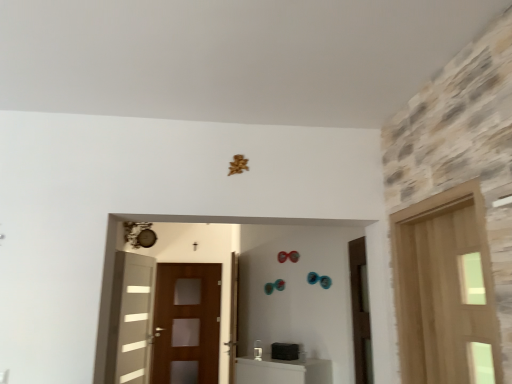
Describe the element at coordinates (360, 312) in the screenshot. I see `brown matte door at right, positioned as the 2th door in front-to-back order` at that location.

At what (x,y) coordinates should I click in order to perform the action: click on wooden door at center, which is the 3th door from right to left. Please return your answer as a coordinate pair (x, y). Looking at the image, I should click on point(233,317).

You are a GUI agent. You are given a task and a screenshot of the screen. Output one action in this format:
    pyautogui.click(x=<x>, y=<y>)
    Task: Click on the light wood door at right, marked as the fourth door in a back-to-front arrangement
    The image size is (512, 384).
    Given the screenshot: What is the action you would take?
    pyautogui.click(x=445, y=290)

Measure the distance between light wood door at right, which is counted as the first door, starting from the right, and camera.

A distance of 5.39 feet exists between light wood door at right, which is counted as the first door, starting from the right, and camera.

Find the location of a particular element. This screenshot has width=512, height=384. brown wooden screen door at center is located at coordinates (187, 320).

Considering the points (149, 329) and (349, 258), which point is behind, point (149, 329) or point (349, 258)?

The point (149, 329) is behind.

In the scene shown: Is white glossy door at left, arranged as the 4th door when viewed from the right, situated inside brown matte door at right, marked as the 3th door in a back-to-front arrangement, or outside?

white glossy door at left, arranged as the 4th door when viewed from the right, is located beyond the bounds of brown matte door at right, marked as the 3th door in a back-to-front arrangement.

How distant is white glossy door at left, which appears as the first door when viewed from the back, from brown matte door at right, which is counted as the second door, starting from the right?

white glossy door at left, which appears as the first door when viewed from the back, is 7.79 feet away from brown matte door at right, which is counted as the second door, starting from the right.

Is white glossy door at left, which appears as the first door when viewed from the back, turned away from brown matte door at right, marked as the 3th door in a back-to-front arrangement?

No, brown matte door at right, marked as the 3th door in a back-to-front arrangement, is not at the back of white glossy door at left, which appears as the first door when viewed from the back.

Does point (138, 323) come farther from viewer compared to point (433, 295)?

Yes.

Is light wood door at right, marked as the fourth door in a back-to-front arrangement, at the back of white glossy door at left, placed as the first door when sorted from left to right?

No, white glossy door at left, placed as the first door when sorted from left to right, is not facing away from light wood door at right, marked as the fourth door in a back-to-front arrangement.

Considering the relative positions of white glossy door at left, arranged as the 4th door when viewed from the right, and light wood door at right, marked as the fourth door in a back-to-front arrangement, in the image provided, is white glossy door at left, arranged as the 4th door when viewed from the right, to the left of light wood door at right, marked as the fourth door in a back-to-front arrangement, from the viewer's perspective?

Indeed, white glossy door at left, arranged as the 4th door when viewed from the right, is positioned on the left side of light wood door at right, marked as the fourth door in a back-to-front arrangement.

Is brown matte door at right, marked as the 3th door in a back-to-front arrangement, further to the viewer compared to white glossy door at left, which is the 4th door from front to back?

No, the depth of brown matte door at right, marked as the 3th door in a back-to-front arrangement, is less than that of white glossy door at left, which is the 4th door from front to back.

In the scene shown: Is brown matte door at right, marked as the 3th door in a back-to-front arrangement, to the left of white glossy door at left, placed as the first door when sorted from left to right, from the viewer's perspective?

In fact, brown matte door at right, marked as the 3th door in a back-to-front arrangement, is to the right of white glossy door at left, placed as the first door when sorted from left to right.

Considering the sizes of brown matte door at right, which is counted as the second door, starting from the right, and white glossy door at left, arranged as the 4th door when viewed from the right, in the image, is brown matte door at right, which is counted as the second door, starting from the right, taller or shorter than white glossy door at left, arranged as the 4th door when viewed from the right,?

Considering their sizes, brown matte door at right, which is counted as the second door, starting from the right, has less height than white glossy door at left, arranged as the 4th door when viewed from the right.

From a real-world perspective, relative to white glossy door at left, which appears as the first door when viewed from the back, is brown matte door at right, positioned as the 2th door in front-to-back order, vertically above or below?

From a real-world perspective, brown matte door at right, positioned as the 2th door in front-to-back order, is physically above white glossy door at left, which appears as the first door when viewed from the back.

Who is taller, brown matte door at right, positioned as the 2th door in front-to-back order, or brown wooden screen door at center?

brown wooden screen door at center is taller.

Based on the photo, considering the relative sizes of brown matte door at right, positioned as the 2th door in front-to-back order, and brown wooden screen door at center in the image provided, is brown matte door at right, positioned as the 2th door in front-to-back order, thinner than brown wooden screen door at center?

No.

Is brown matte door at right, positioned as the 2th door in front-to-back order, smaller than brown wooden screen door at center?

Correct, brown matte door at right, positioned as the 2th door in front-to-back order, occupies less space than brown wooden screen door at center.

Could you tell me if light wood door at right, marked as the fourth door in a back-to-front arrangement, is facing brown matte door at right, which is counted as the second door, starting from the right?

No, light wood door at right, marked as the fourth door in a back-to-front arrangement, is not facing towards brown matte door at right, which is counted as the second door, starting from the right.

Which object is thinner, light wood door at right, marked as the fourth door in a back-to-front arrangement, or brown matte door at right, which is counted as the second door, starting from the right?

With smaller width is brown matte door at right, which is counted as the second door, starting from the right.

Is light wood door at right, which is counted as the first door, starting from the right, not inside brown matte door at right, positioned as the 2th door in front-to-back order?

Absolutely, light wood door at right, which is counted as the first door, starting from the right, is external to brown matte door at right, positioned as the 2th door in front-to-back order.

From the image's perspective, is light wood door at right, marked as the fourth door in a back-to-front arrangement, over brown matte door at right, the 3th door positioned from the left?

Yes, from the image's perspective, light wood door at right, marked as the fourth door in a back-to-front arrangement, is over brown matte door at right, the 3th door positioned from the left.

How different are the orientations of brown matte door at right, marked as the 3th door in a back-to-front arrangement, and light wood door at right, which is counted as the first door, starting from the front, in degrees?

0.00168 degrees.

From the picture: Does brown matte door at right, marked as the 3th door in a back-to-front arrangement, turn towards light wood door at right, marked as the fourth door in a back-to-front arrangement?

No.

Can you confirm if brown matte door at right, which is counted as the second door, starting from the right, is wider than light wood door at right, marked as the fourth door in a back-to-front arrangement?

No, brown matte door at right, which is counted as the second door, starting from the right, is not wider than light wood door at right, marked as the fourth door in a back-to-front arrangement.

From a real-world perspective, which door is the 1st one underneath the light wood door at right, which is counted as the first door, starting from the front? Please provide its 2D coordinates.

[(360, 312)]

Is point (486, 323) closer to viewer compared to point (232, 292)?

Yes, it is in front of point (232, 292).

Is light wood door at right, marked as the fourth door in a back-to-front arrangement, wider than wooden door at center, which ranks as the 2th door in left-to-right order?

Indeed, light wood door at right, marked as the fourth door in a back-to-front arrangement, has a greater width compared to wooden door at center, which ranks as the 2th door in left-to-right order.

Would you say light wood door at right, marked as the fourth door in a back-to-front arrangement, is inside or outside wooden door at center, which ranks as the 2th door in left-to-right order?

light wood door at right, marked as the fourth door in a back-to-front arrangement, lies outside wooden door at center, which ranks as the 2th door in left-to-right order.

From the image's perspective, is light wood door at right, which is counted as the first door, starting from the front, above or below wooden door at center, which ranks as the 2th door in left-to-right order?

From the image's perspective, light wood door at right, which is counted as the first door, starting from the front, appears above wooden door at center, which ranks as the 2th door in left-to-right order.

You are a GUI agent. You are given a task and a screenshot of the screen. Output one action in this format:
    pyautogui.click(x=<x>, y=<y>)
    Task: Click on the 2nd door in front of the white glossy door at left, which is the 4th door from front to back
    The height and width of the screenshot is (384, 512).
    Given the screenshot: What is the action you would take?
    pyautogui.click(x=360, y=312)

Image resolution: width=512 pixels, height=384 pixels. I want to click on the 3rd door to the right when counting from the white glossy door at left, which is the 4th door from front to back, so click(445, 290).

From the picture: From the image, which object appears to be farther from white glossy door at left, which appears as the first door when viewed from the back, brown matte door at right, the 3th door positioned from the left, or wooden door at center, the second door when ordered from back to front?

brown matte door at right, the 3th door positioned from the left, is further to white glossy door at left, which appears as the first door when viewed from the back.

Which object lies further to the anchor point white glossy door at left, which is the 4th door from front to back, wooden door at center, which is the 3th door from right to left, or brown matte door at right, marked as the 3th door in a back-to-front arrangement?

brown matte door at right, marked as the 3th door in a back-to-front arrangement, is further to white glossy door at left, which is the 4th door from front to back.

Looking at the image, which one is located closer to wooden door at center, which is the 3th door from right to left, brown matte door at right, which is counted as the second door, starting from the right, or brown wooden screen door at center?

brown wooden screen door at center is closer to wooden door at center, which is the 3th door from right to left.

Which object lies further to the anchor point white glossy door at left, arranged as the 4th door when viewed from the right, wooden door at center, the 3th door positioned from the front, or brown wooden screen door at center?

Based on the image, wooden door at center, the 3th door positioned from the front, appears to be further to white glossy door at left, arranged as the 4th door when viewed from the right.

Looking at the image, which one is located closer to brown matte door at right, positioned as the 2th door in front-to-back order, light wood door at right, marked as the fourth door in a back-to-front arrangement, or brown wooden screen door at center?

The object closer to brown matte door at right, positioned as the 2th door in front-to-back order, is light wood door at right, marked as the fourth door in a back-to-front arrangement.

Estimate the real-world distances between objects in this image. Which object is further from brown matte door at right, the 3th door positioned from the left, white glossy door at left, arranged as the 4th door when viewed from the right, or light wood door at right, which is counted as the fourth door, starting from the left?

white glossy door at left, arranged as the 4th door when viewed from the right.

Based on their spatial positions, is brown matte door at right, marked as the 3th door in a back-to-front arrangement, or white glossy door at left, placed as the first door when sorted from left to right, further from brown wooden screen door at center?

brown matte door at right, marked as the 3th door in a back-to-front arrangement, is positioned further to the anchor brown wooden screen door at center.

Consider the image. Which object lies further to the anchor point wooden door at center, the 3th door positioned from the front, light wood door at right, marked as the fourth door in a back-to-front arrangement, or brown wooden screen door at center?

The object further to wooden door at center, the 3th door positioned from the front, is light wood door at right, marked as the fourth door in a back-to-front arrangement.

You are a GUI agent. You are given a task and a screenshot of the screen. Output one action in this format:
    pyautogui.click(x=<x>, y=<y>)
    Task: Click on the door between wooden door at center, the 3th door positioned from the front, and brown wooden screen door at center in the front-back direction
    The width and height of the screenshot is (512, 384).
    Given the screenshot: What is the action you would take?
    pyautogui.click(x=131, y=319)

The width and height of the screenshot is (512, 384). Identify the location of door positioned between light wood door at right, which is counted as the fourth door, starting from the left, and wooden door at center, which is the 3th door from right to left, from near to far. (360, 312).

The width and height of the screenshot is (512, 384). I want to click on door situated between white glossy door at left, which appears as the first door when viewed from the back, and brown matte door at right, positioned as the 2th door in front-to-back order, from left to right, so point(233,317).